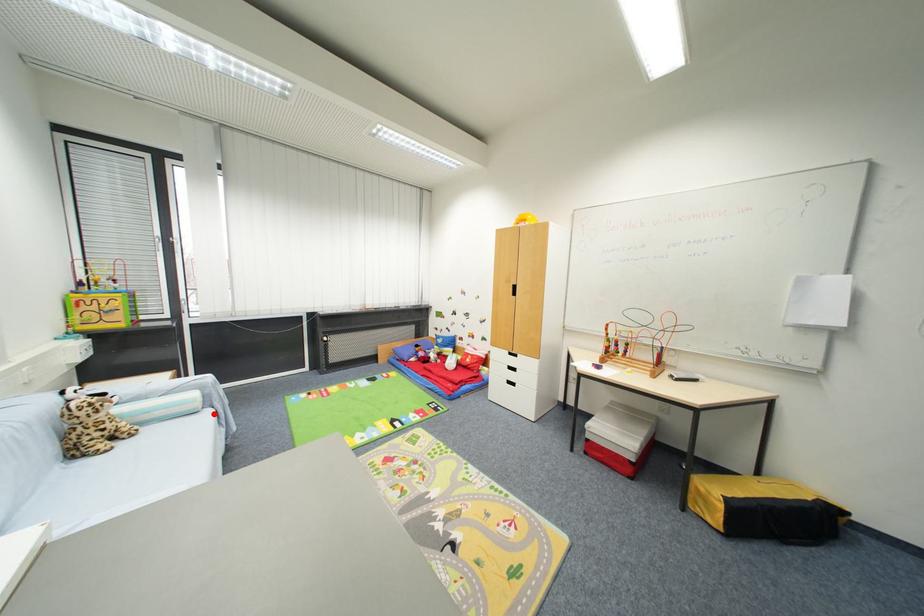
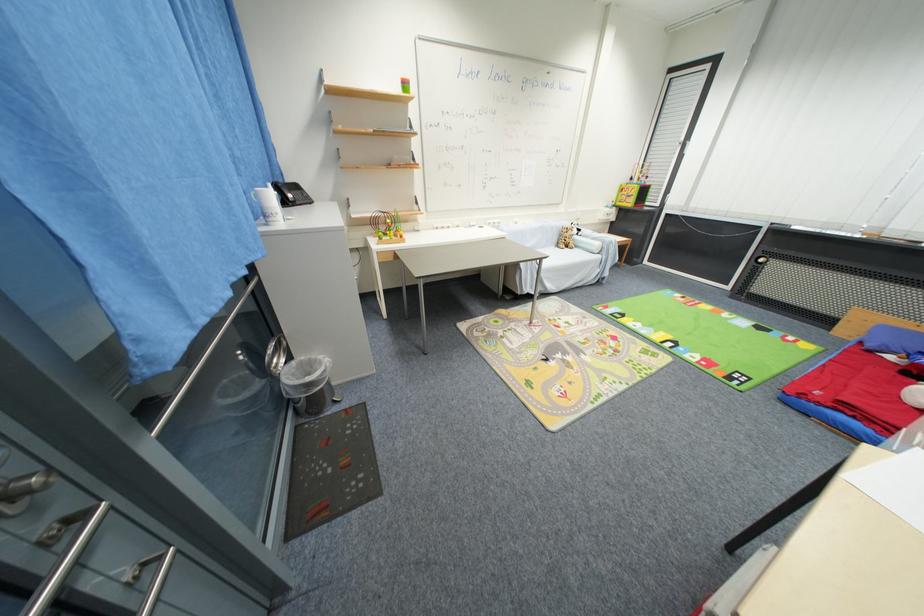
Find the pixel in the second image that matches the highlighted location in the first image.

(603, 259)